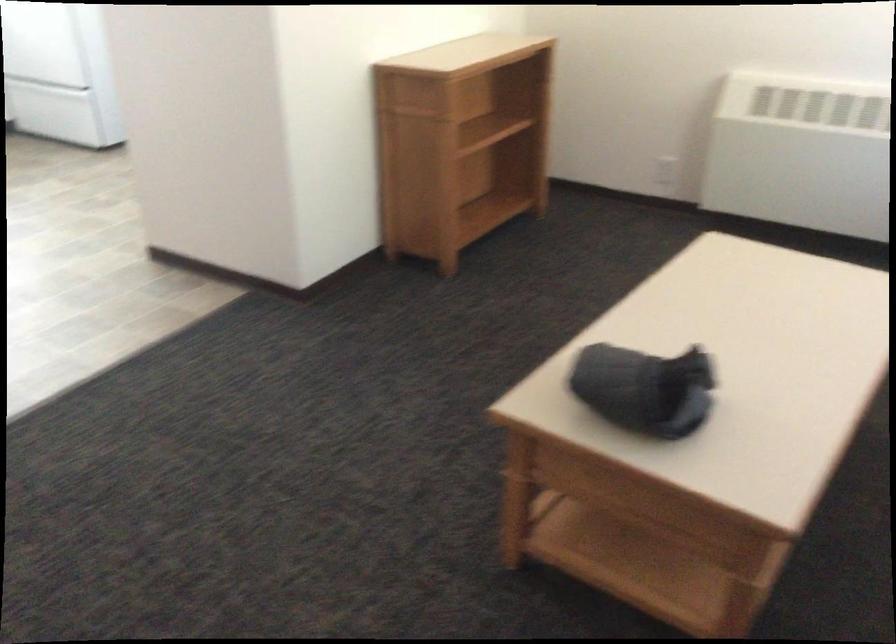
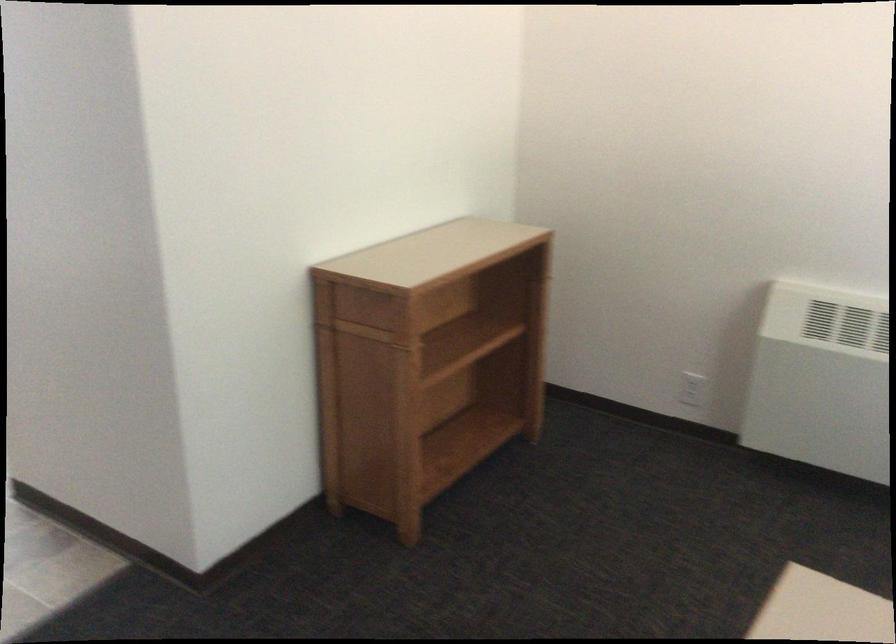
Find the pixel in the second image that matches (x=485, y=129) in the first image.

(462, 345)